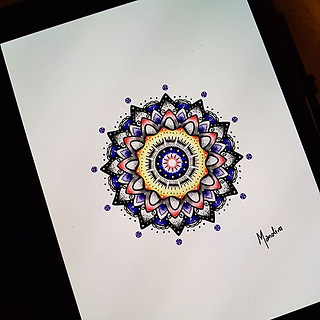
Locate an element on the screen. This screenshot has height=320, width=320. drawing surface is located at coordinates (26, 262), (300, 114).